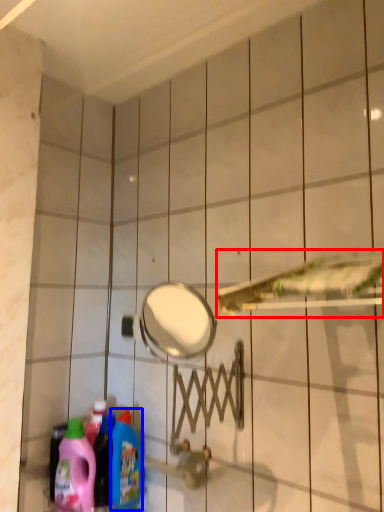
Question: Which point is further to the camera, shower (highlighted by a red box) or cleaning product (highlighted by a blue box)?

Choices:
 (A) shower
 (B) cleaning product

Answer: (B)